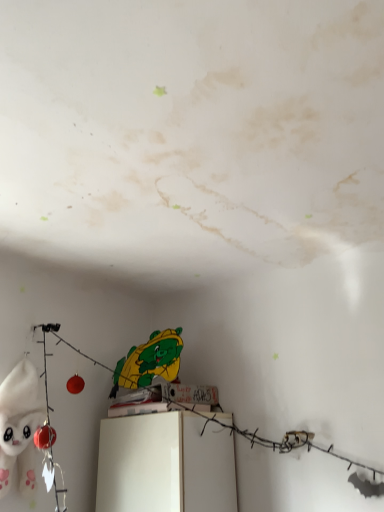
Question: Can you confirm if white plush toy at left is positioned to the right of white glossy cabinet at center?

Choices:
 (A) yes
 (B) no

Answer: (B)

Question: Are white plush toy at left and white glossy cabinet at center located far from each other?

Choices:
 (A) yes
 (B) no

Answer: (B)

Question: From a real-world perspective, is white plush toy at left physically above white glossy cabinet at center?

Choices:
 (A) no
 (B) yes

Answer: (B)

Question: Is white plush toy at left closer to the viewer compared to white glossy cabinet at center?

Choices:
 (A) yes
 (B) no

Answer: (A)

Question: Is white plush toy at left smaller than white glossy cabinet at center?

Choices:
 (A) no
 (B) yes

Answer: (B)

Question: Does white plush toy at left come behind white glossy cabinet at center?

Choices:
 (A) no
 (B) yes

Answer: (A)

Question: Could you tell me if white glossy cabinet at center is turned towards white plush toy at left?

Choices:
 (A) no
 (B) yes

Answer: (B)

Question: From the image's perspective, is white glossy cabinet at center located beneath white plush toy at left?

Choices:
 (A) yes
 (B) no

Answer: (A)

Question: From a real-world perspective, is white glossy cabinet at center physically below white plush toy at left?

Choices:
 (A) no
 (B) yes

Answer: (B)

Question: Considering the relative sizes of white glossy cabinet at center and white plush toy at left in the image provided, is white glossy cabinet at center taller than white plush toy at left?

Choices:
 (A) no
 (B) yes

Answer: (A)

Question: Is the depth of white glossy cabinet at center greater than that of white plush toy at left?

Choices:
 (A) no
 (B) yes

Answer: (B)

Question: From the image's perspective, is white glossy cabinet at center above white plush toy at left?

Choices:
 (A) no
 (B) yes

Answer: (A)

Question: Is white plush toy at left wider or thinner than white glossy cabinet at center?

Choices:
 (A) thin
 (B) wide

Answer: (A)